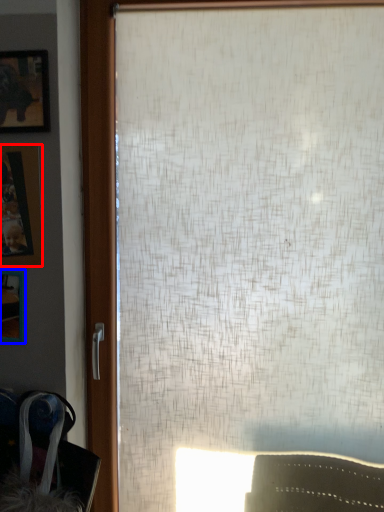
Question: Which of the following is the closest to the observer, picture frame (highlighted by a red box) or picture frame (highlighted by a blue box)?

Choices:
 (A) picture frame
 (B) picture frame

Answer: (A)